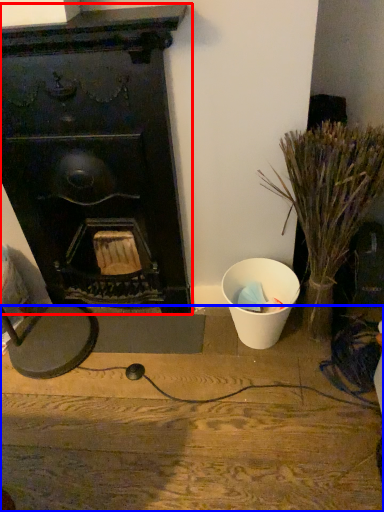
Question: Among these objects, which one is farthest to the camera, fireplace (highlighted by a red box) or furniture (highlighted by a blue box)?

Choices:
 (A) fireplace
 (B) furniture

Answer: (B)